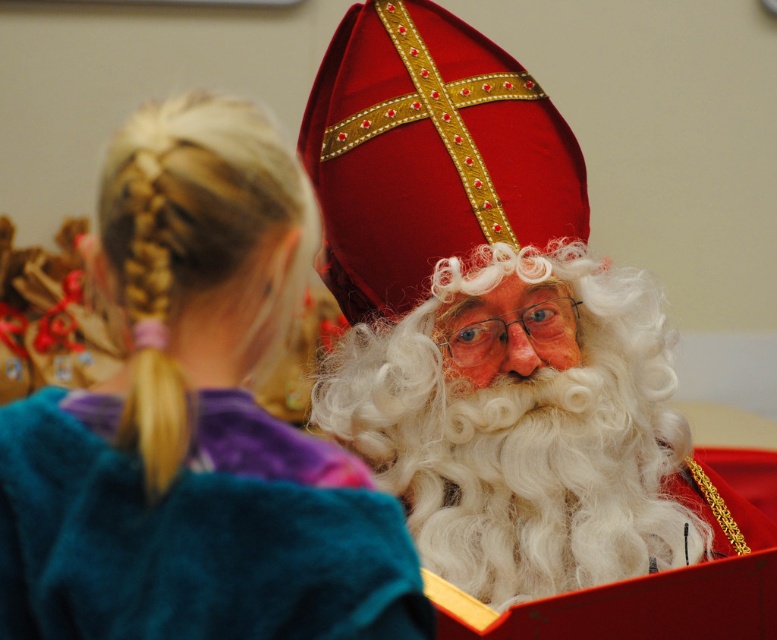
Who is more distant from viewer, (173,248) or (472,440)?

Point (472,440)

Can you confirm if teal fleece sweater at upper left is positioned below white curly hair at center?

Incorrect, teal fleece sweater at upper left is not positioned below white curly hair at center.

At what (x,y) coordinates should I click in order to perform the action: click on teal fleece sweater at upper left. Please return your answer as a coordinate pair (x, y). The width and height of the screenshot is (777, 640). Looking at the image, I should click on (194, 420).

Does point (427, 337) come closer to viewer compared to point (539, 284)?

Yes, point (427, 337) is in front of point (539, 284).

Is velvet red hat at upper center wider than white curly hair at center?

Yes, velvet red hat at upper center is wider than white curly hair at center.

This screenshot has height=640, width=777. What are the coordinates of `velvet red hat at upper center` in the screenshot? It's located at (493, 324).

Does velvet red hat at upper center have a greater height compared to teal fuzzy robe at upper left?

Yes.

How far apart are velvet red hat at upper center and teal fuzzy robe at upper left?

velvet red hat at upper center is 1.09 meters away from teal fuzzy robe at upper left.

Is point (646, 385) positioned in front of point (124, 630)?

No, (646, 385) is behind (124, 630).

This screenshot has width=777, height=640. What are the coordinates of `velvet red hat at upper center` in the screenshot? It's located at (493, 324).